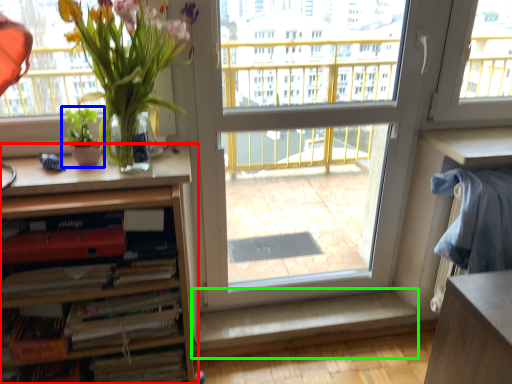
Question: Which object is the farthest from cabinetry (highlighted by a red box)? Choose among these: houseplant (highlighted by a blue box) or window sill (highlighted by a green box).

Choices:
 (A) houseplant
 (B) window sill

Answer: (B)